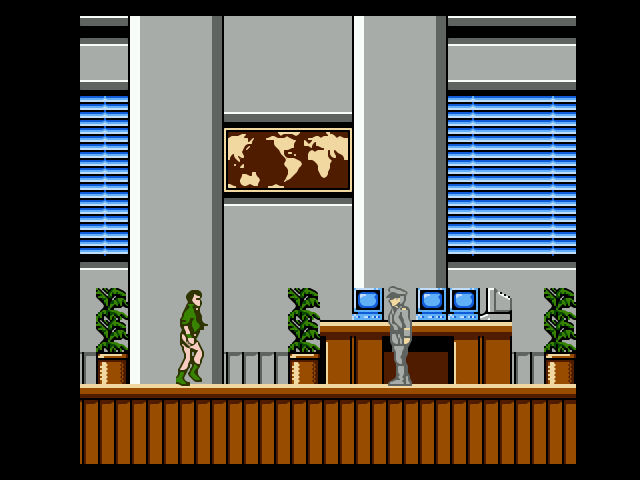
Identify the location of floor. This screenshot has height=480, width=640. (228, 387).